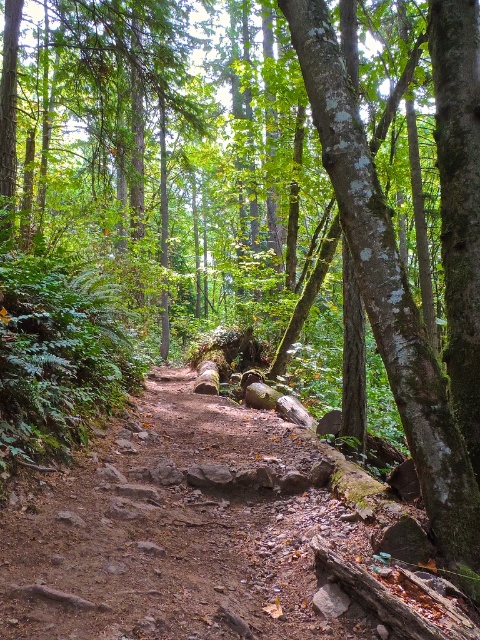
You are standing at the starting point of the forest trail and want to reach the dirt path at center. According to the coordinates provided, in which direction should you move relative to your current position?

The dirt path at center is located at coordinates point (216, 536), so you should move towards the center of the image to reach it.

You are standing at the start of the forest trail and see two points marked on the path. The first point is at coordinates point (249, 632) and the second is at point (447, 488). Which point is nearer to you as you begin your walk?

Point (249, 632) is closer to the camera than point (447, 488), so the first point is nearer to you as you begin your walk.

In the scene shown: You are a hiker standing at the start of the trail. You need to walk along the dirt path at center and pass the green mossy tree trunk at right. Which side should you take to stay on the path while passing the tree?

The dirt path at center is positioned on the left side of green mossy tree trunk at right, so you should take the left side to stay on the path while passing the tree.